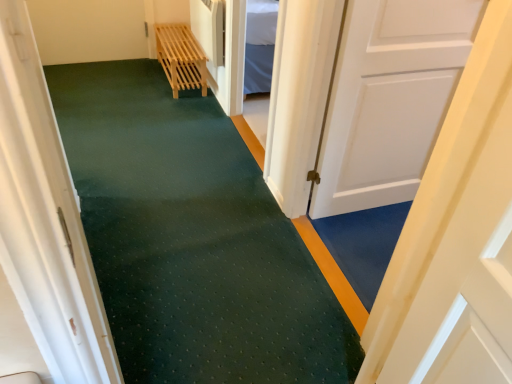
The height and width of the screenshot is (384, 512). Describe the element at coordinates (456, 239) in the screenshot. I see `white matte door at center, the second door viewed from the right` at that location.

What is the approximate height of white matte door at right, which appears as the first door when viewed from the right?

It is 1.07 meters.

Measure the distance between point (433, 39) and camera.

They are 1.74 meters apart.

Find the location of a particular element. The height and width of the screenshot is (384, 512). light wood slatted bench at upper center is located at coordinates (181, 57).

Would you consider white matte door at right, which appears as the first door when viewed from the right, to be distant from white matte door at center, the second door viewed from the right?

No, white matte door at right, which appears as the first door when viewed from the right, is not far from white matte door at center, the second door viewed from the right.

Which object is thinner, white matte door at right, which appears as the first door when viewed from the right, or white matte door at center, placed as the first door when sorted from left to right?

white matte door at right, which appears as the first door when viewed from the right.

Between point (450, 79) and point (460, 125), which one is positioned in front?

The point (460, 125) is closer to the camera.

Considering the sizes of objects white matte door at center, placed as the first door when sorted from left to right, and white matte door at right, which is the 2th door in left-to-right order, in the image provided, who is taller, white matte door at center, placed as the first door when sorted from left to right, or white matte door at right, which is the 2th door in left-to-right order,?

Standing taller between the two is white matte door at center, placed as the first door when sorted from left to right.

You are a GUI agent. You are given a task and a screenshot of the screen. Output one action in this format:
    pyautogui.click(x=<x>, y=<y>)
    Task: Click on the door that is under the white matte door at center, the second door viewed from the right (from a real-world perspective)
    This screenshot has width=512, height=384.
    Given the screenshot: What is the action you would take?
    pyautogui.click(x=390, y=99)

Based on the photo, from a real-world perspective, which object stands above the other?

In real-world perspective, white matte door at center, the second door viewed from the right, is above.

Is point (480, 162) closer or farther from the camera than point (387, 110)?

Point (480, 162) appears to be closer to the viewer than point (387, 110).

Based on the photo, could you measure the distance between light wood slatted bench at upper center and white matte door at right, which is the 2th door in left-to-right order?

The distance of light wood slatted bench at upper center from white matte door at right, which is the 2th door in left-to-right order, is 5.17 feet.

Between light wood slatted bench at upper center and white matte door at right, which is the 2th door in left-to-right order, which one has smaller width?

white matte door at right, which is the 2th door in left-to-right order, is thinner.

Does light wood slatted bench at upper center have a smaller size compared to white matte door at right, which is the 2th door in left-to-right order?

No, light wood slatted bench at upper center is not smaller than white matte door at right, which is the 2th door in left-to-right order.

In the scene shown: Considering the relative positions of light wood slatted bench at upper center and white matte door at right, which is the 2th door in left-to-right order, in the image provided, is light wood slatted bench at upper center to the right of white matte door at right, which is the 2th door in left-to-right order, from the viewer's perspective?

In fact, light wood slatted bench at upper center is to the left of white matte door at right, which is the 2th door in left-to-right order.

Is the position of white matte door at center, placed as the first door when sorted from left to right, more distant than that of light wood slatted bench at upper center?

No, it is in front of light wood slatted bench at upper center.

Is white matte door at center, the second door viewed from the right, positioned with its back to light wood slatted bench at upper center?

No, white matte door at center, the second door viewed from the right, is not facing the opposite direction of light wood slatted bench at upper center.

Consider the image. From the image's perspective, relative to light wood slatted bench at upper center, is white matte door at center, placed as the first door when sorted from left to right, above or below?

Clearly, from the image's perspective, white matte door at center, placed as the first door when sorted from left to right, is below light wood slatted bench at upper center.

Considering the relative positions of white matte door at center, the second door viewed from the right, and light wood slatted bench at upper center in the image provided, is white matte door at center, the second door viewed from the right, to the left of light wood slatted bench at upper center from the viewer's perspective?

Incorrect, white matte door at center, the second door viewed from the right, is not on the left side of light wood slatted bench at upper center.

Looking at this image, is white matte door at right, which appears as the first door when viewed from the right, to the right of light wood slatted bench at upper center from the viewer's perspective?

Indeed, white matte door at right, which appears as the first door when viewed from the right, is positioned on the right side of light wood slatted bench at upper center.

Could you tell me if white matte door at right, which appears as the first door when viewed from the right, is turned towards light wood slatted bench at upper center?

No, white matte door at right, which appears as the first door when viewed from the right, is not facing towards light wood slatted bench at upper center.

Could you measure the distance between white matte door at right, which appears as the first door when viewed from the right, and light wood slatted bench at upper center?

They are 5.17 feet apart.

Considering the sizes of objects white matte door at right, which is the 2th door in left-to-right order, and light wood slatted bench at upper center in the image provided, who is shorter, white matte door at right, which is the 2th door in left-to-right order, or light wood slatted bench at upper center?

Standing shorter between the two is light wood slatted bench at upper center.

Would you say light wood slatted bench at upper center is inside or outside white matte door at center, the second door viewed from the right?

The correct answer is: outside.

Locate an element on the screen. the 2nd door below the light wood slatted bench at upper center (from the image's perspective) is located at coordinates (456, 239).

Between light wood slatted bench at upper center and white matte door at center, the second door viewed from the right, which one has larger size?

Bigger between the two is white matte door at center, the second door viewed from the right.

Locate an element on the screen. door in front of the white matte door at right, which is the 2th door in left-to-right order is located at coordinates point(456,239).

What are the coordinates of `door directly beneath the white matte door at center, placed as the first door when sorted from left to right (from a real-world perspective)` in the screenshot? It's located at (390, 99).

In the scene shown: From the image, which object appears to be farther from white matte door at center, the second door viewed from the right, white matte door at right, which is the 2th door in left-to-right order, or light wood slatted bench at upper center?

light wood slatted bench at upper center is positioned further to the anchor white matte door at center, the second door viewed from the right.

When comparing their distances from white matte door at right, which appears as the first door when viewed from the right, does light wood slatted bench at upper center or white matte door at center, the second door viewed from the right, seem closer?

Among the two, white matte door at center, the second door viewed from the right, is located nearer to white matte door at right, which appears as the first door when viewed from the right.

Based on their spatial positions, is white matte door at right, which is the 2th door in left-to-right order, or white matte door at center, the second door viewed from the right, closer to light wood slatted bench at upper center?

white matte door at right, which is the 2th door in left-to-right order.

Estimate the real-world distances between objects in this image. Which object is further from light wood slatted bench at upper center, white matte door at center, placed as the first door when sorted from left to right, or white matte door at right, which appears as the first door when viewed from the right?

white matte door at center, placed as the first door when sorted from left to right.

Considering their positions, is light wood slatted bench at upper center positioned closer to white matte door at center, placed as the first door when sorted from left to right, than white matte door at right, which is the 2th door in left-to-right order?

Among the two, white matte door at right, which is the 2th door in left-to-right order, is located nearer to white matte door at center, placed as the first door when sorted from left to right.

Estimate the real-world distances between objects in this image. Which object is closer to white matte door at right, which appears as the first door when viewed from the right, white matte door at center, the second door viewed from the right, or light wood slatted bench at upper center?

white matte door at center, the second door viewed from the right, is positioned closer to the anchor white matte door at right, which appears as the first door when viewed from the right.

This screenshot has height=384, width=512. Find the location of `door between white matte door at center, placed as the first door when sorted from left to right, and light wood slatted bench at upper center, along the z-axis`. door between white matte door at center, placed as the first door when sorted from left to right, and light wood slatted bench at upper center, along the z-axis is located at coordinates (390, 99).